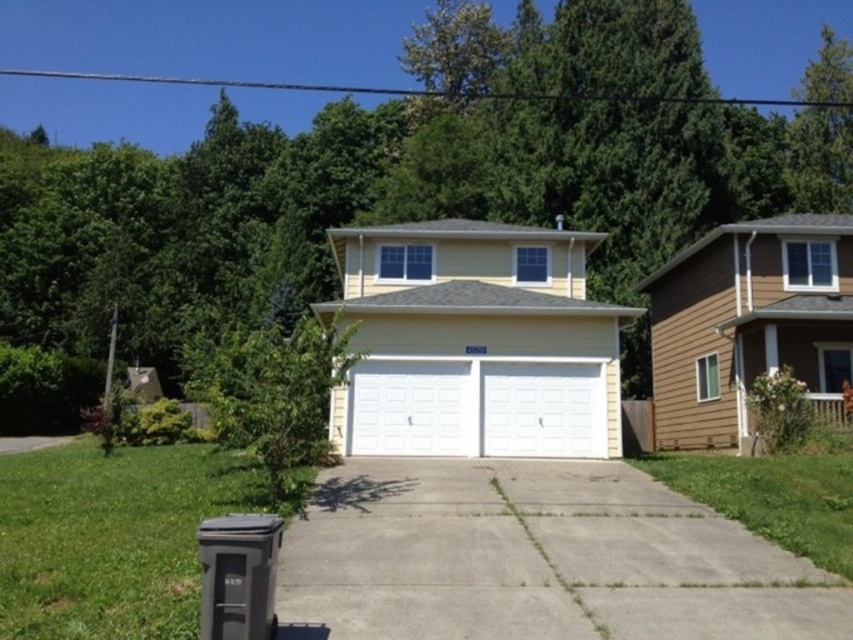
You are standing in front of the house and want to open the white painted wood garage doors at center. Which direction should you walk to reach them from the white smooth garage door at center?

The white painted wood garage doors at center are positioned on the right side of the white smooth garage door at center, so you should walk to the right to reach them.

You are a delivery person trying to park a delivery van that is 2 meters wide. You see the white painted wood garage doors at center and the white smooth garage door at center. Can you fit the van between them?

The distance between the white painted wood garage doors at center and the white smooth garage door at center is 1.47 meters, which is narrower than the van width of 2 meters. Therefore, the van cannot fit between them.

You are driving a delivery van that is 6 meters long. You need to park your van on the gray concrete driveway at center near the white painted wood garage doors at center. Can your van fit entirely on the driveway without overhanging the driveway edges?

The distance between the gray concrete driveway at center and the white painted wood garage doors at center is 6.56 meters. Since the van is 6 meters long, it can fit on the driveway as there is enough space to accommodate its length without overhanging.